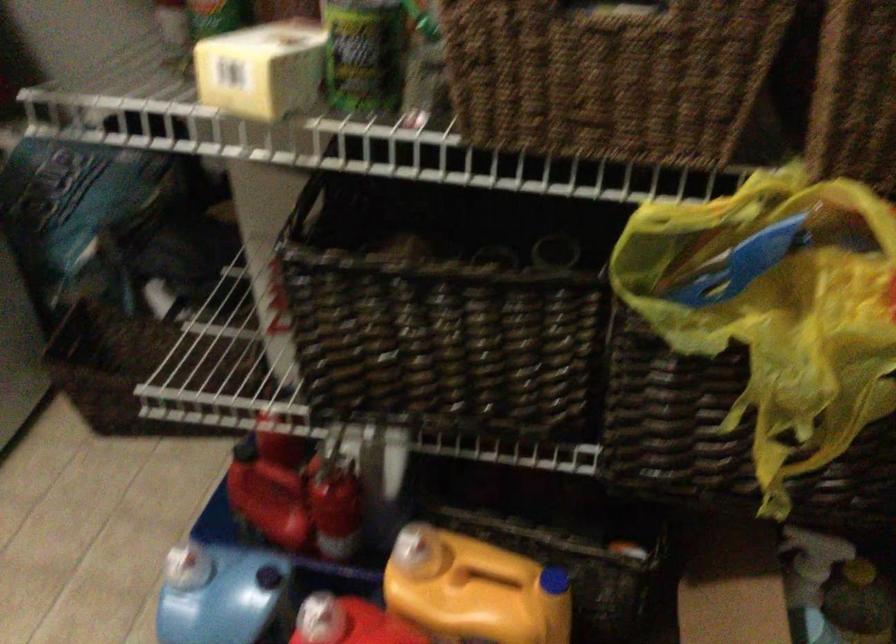
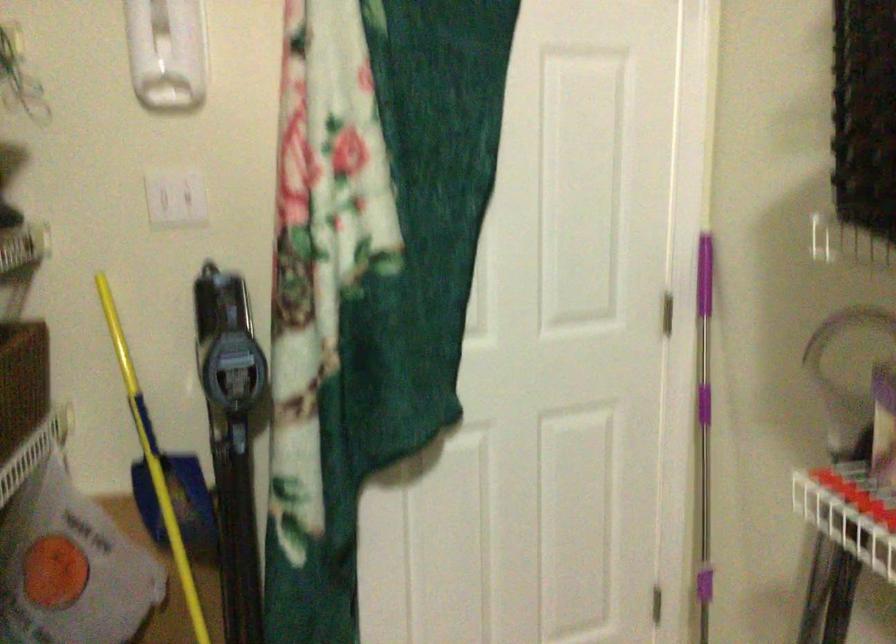
How did the camera likely rotate?

The rotation direction of the camera is right-down.